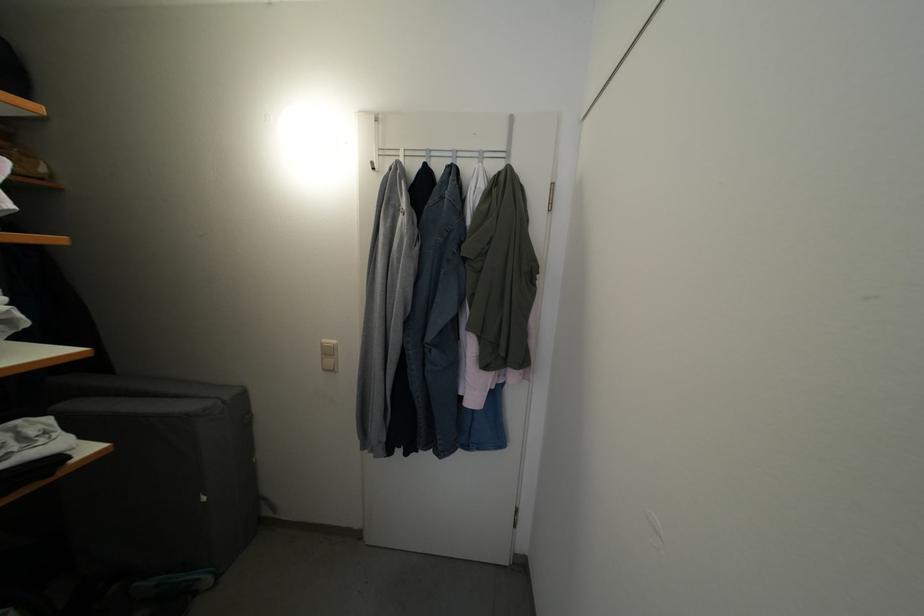
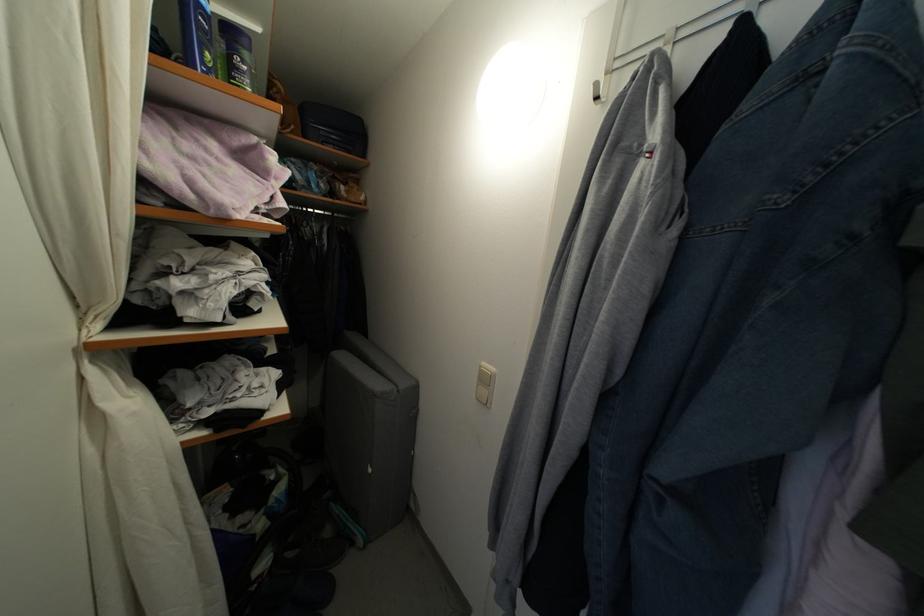
Question: The first image is from the beginning of the video and the second image is from the end. How did the camera likely rotate when shooting the video?

Choices:
 (A) Left
 (B) Right
 (C) Up
 (D) Down

Answer: (A)